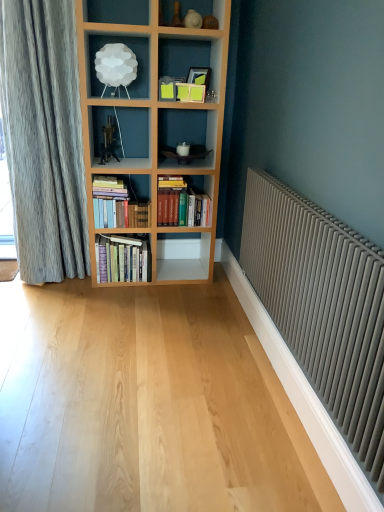
Where is `free point above matte gray radiator at right (from a real-world perspective)`? Image resolution: width=384 pixels, height=512 pixels. free point above matte gray radiator at right (from a real-world perspective) is located at coordinates (325, 218).